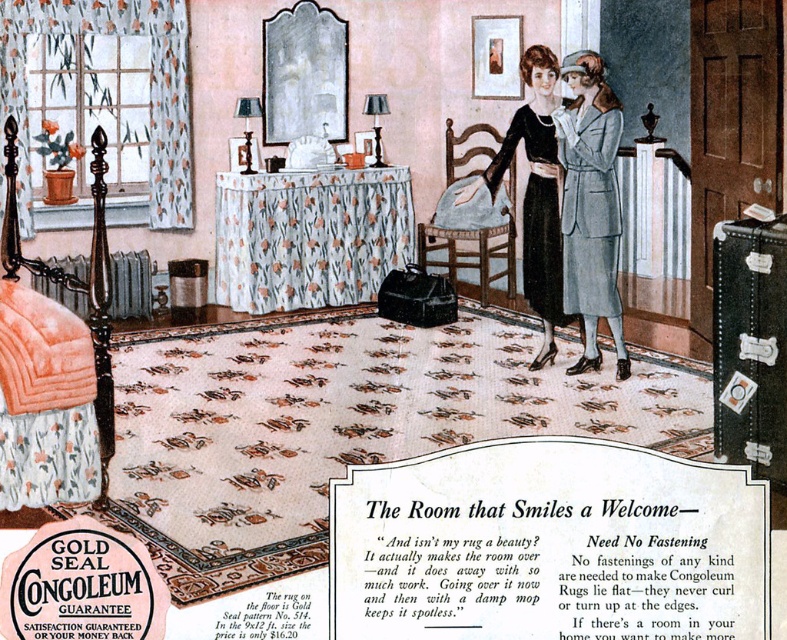
Which is more to the left, light gray wool suit at center or matte black dress at center?

matte black dress at center

Who is more distant from viewer, (610, 198) or (560, 301)?

Point (560, 301)

What do you see at coordinates (590, 205) in the screenshot?
I see `light gray wool suit at center` at bounding box center [590, 205].

What are the coordinates of `light gray wool suit at center` in the screenshot? It's located at click(590, 205).

Which of these two, white carpet at center or matte black dress at center, stands shorter?

white carpet at center is shorter.

Can you confirm if white carpet at center is taller than matte black dress at center?

No, white carpet at center is not taller than matte black dress at center.

Who is more distant from viewer, (346,595) or (508,132)?

Point (508,132)

Locate an element on the screen. This screenshot has height=640, width=787. white carpet at center is located at coordinates (549, 545).

Is white carpet at center bigger than light gray wool suit at center?

No, white carpet at center is not bigger than light gray wool suit at center.

Is point (438, 493) closer to camera compared to point (571, 305)?

Yes, it is in front of point (571, 305).

Is point (743, 616) in front of point (586, 93)?

Yes.

Find the location of a particular element. The height and width of the screenshot is (640, 787). white carpet at center is located at coordinates (549, 545).